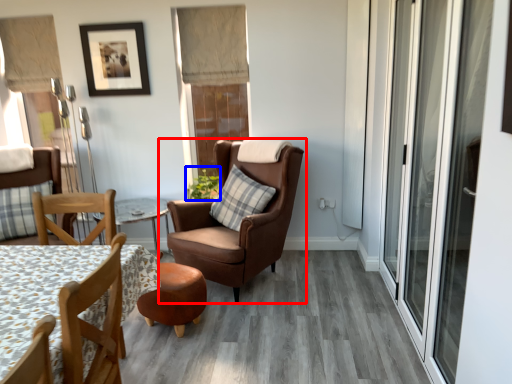
Question: Which point is closer to the camera, chair (highlighted by a red box) or plant (highlighted by a blue box)?

Choices:
 (A) chair
 (B) plant

Answer: (A)